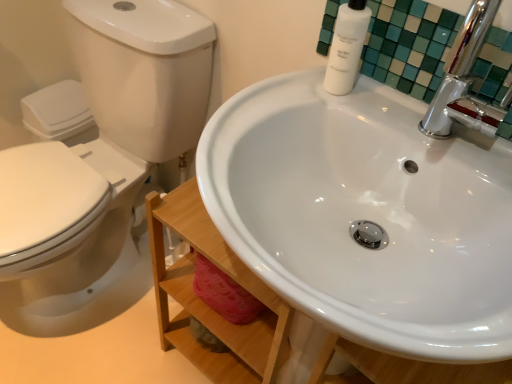
Question: Considering their positions, is white glossy toilet at left located in front of or behind white matte bottle at upper right?

Choices:
 (A) behind
 (B) front

Answer: (B)

Question: From the image's perspective, is white glossy toilet at left above or below white matte bottle at upper right?

Choices:
 (A) below
 (B) above

Answer: (A)

Question: Estimate the real-world distances between objects in this image. Which object is closer to the white glossy toilet at left?

Choices:
 (A) white glossy sink at center
 (B) white glossy bottle at upper right
 (C) white matte bottle at upper right

Answer: (A)

Question: Based on their relative distances, which object is nearer to the white glossy sink at center?

Choices:
 (A) white glossy bottle at upper right
 (B) white glossy toilet at left
 (C) white matte bottle at upper right

Answer: (A)